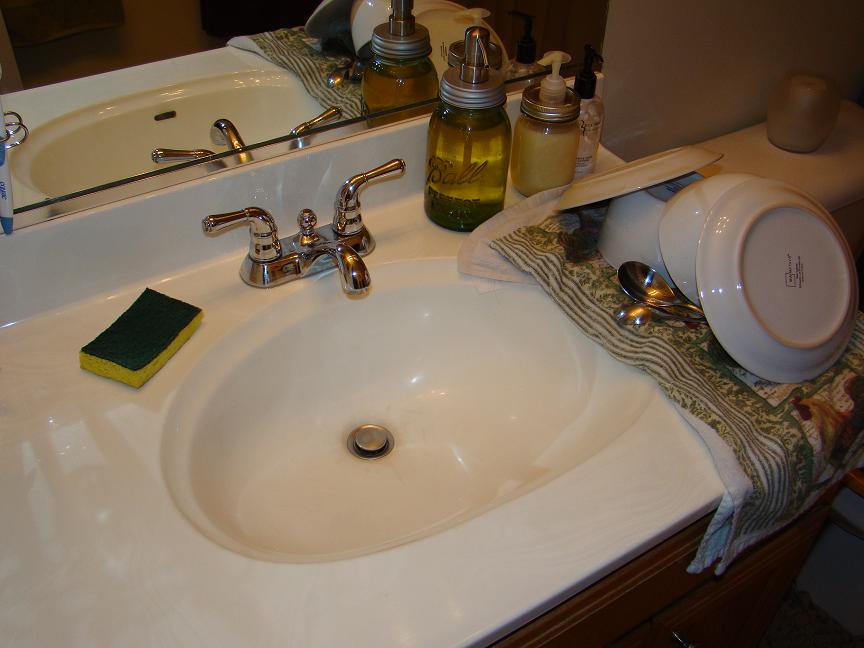
Identify the location of wall. (695, 84).